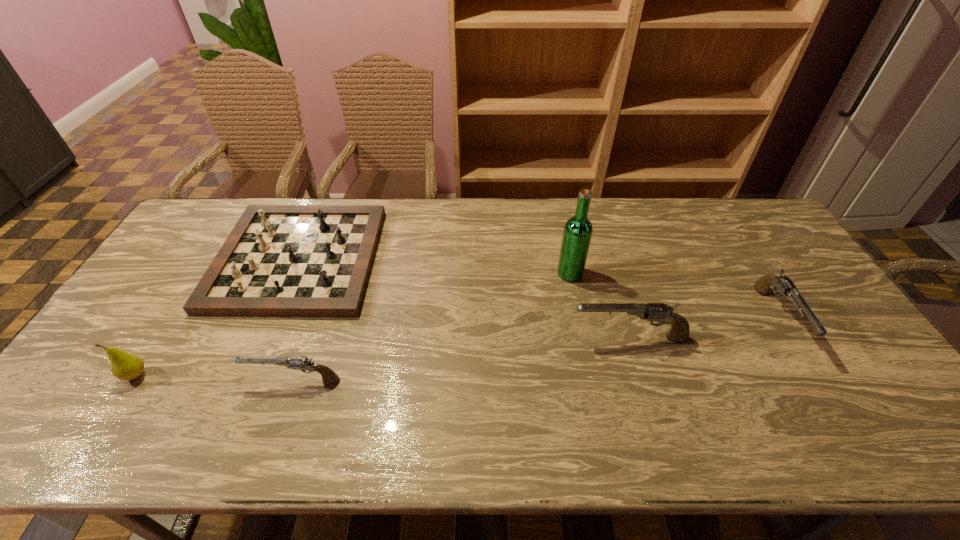
At what (x,y) coordinates should I click in order to perform the action: click on vacant space located 0.060m aiming along the barrel of the leftmost gun. Please return your answer as a coordinate pair (x, y). Looking at the image, I should click on (226, 380).

The image size is (960, 540). I want to click on free region located 0.190m aiming along the barrel of the second gun from left to right, so click(x=500, y=337).

Find the location of a particular element. The image size is (960, 540). free space located aiming along the barrel of the second gun from left to right is located at coordinates (434, 337).

Where is `vacant region located aiming along the barrel of the second gun from left to right`? This screenshot has width=960, height=540. vacant region located aiming along the barrel of the second gun from left to right is located at coordinates (460, 337).

Find the location of a particular element. free space located 0.050m aiming along the barrel of the rightmost gun is located at coordinates (812, 375).

Identify the location of vacant space located on the right of the chessboard. This screenshot has width=960, height=540. (427, 259).

In order to click on free spot located on the right of the leftmost object in this screenshot , I will do `click(264, 375)`.

The image size is (960, 540). What are the coordinates of `vacant space located on the right of the tallest object` in the screenshot? It's located at (628, 273).

Locate an element on the screen. This screenshot has height=540, width=960. object present at the far edge is located at coordinates click(x=279, y=260).

The image size is (960, 540). What are the coordinates of `gun that is at the near edge` in the screenshot? It's located at (302, 363).